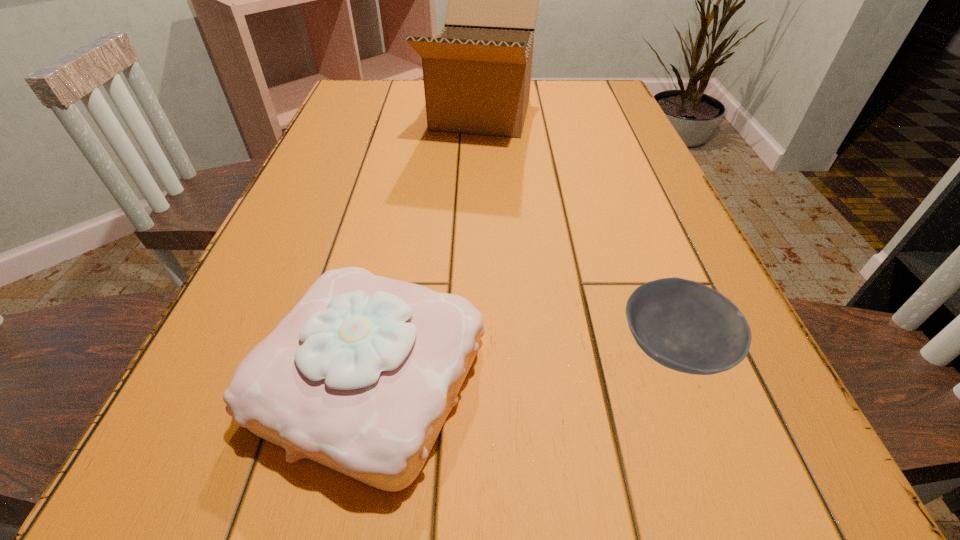
Locate an element on the screen. The image size is (960, 540). object that is at the left edge is located at coordinates (360, 376).

Identify the location of object that is at the right edge. The height and width of the screenshot is (540, 960). (683, 325).

Locate an element on the screen. The height and width of the screenshot is (540, 960). object that is positioned at the near left corner is located at coordinates (360, 376).

You are a GUI agent. You are given a task and a screenshot of the screen. Output one action in this format:
    pyautogui.click(x=<x>, y=<y>)
    Task: Click on the free region at the far edge
    The height and width of the screenshot is (540, 960).
    Given the screenshot: What is the action you would take?
    pyautogui.click(x=402, y=112)

Find the location of a particular element. The height and width of the screenshot is (540, 960). vacant space at the left edge is located at coordinates (290, 215).

Image resolution: width=960 pixels, height=540 pixels. In the image, there is a desktop. Find the location of `blank space at the right edge`. blank space at the right edge is located at coordinates (611, 252).

Identify the location of vacant space at the far left corner. (365, 82).

Image resolution: width=960 pixels, height=540 pixels. Identify the location of free space at the far right corner of the desktop. (578, 112).

The height and width of the screenshot is (540, 960). What are the coordinates of `unoccupied area between the second shortest object and the bowl` in the screenshot? It's located at (521, 365).

The image size is (960, 540). I want to click on vacant space that is in between the second tallest object and the tallest object, so click(426, 247).